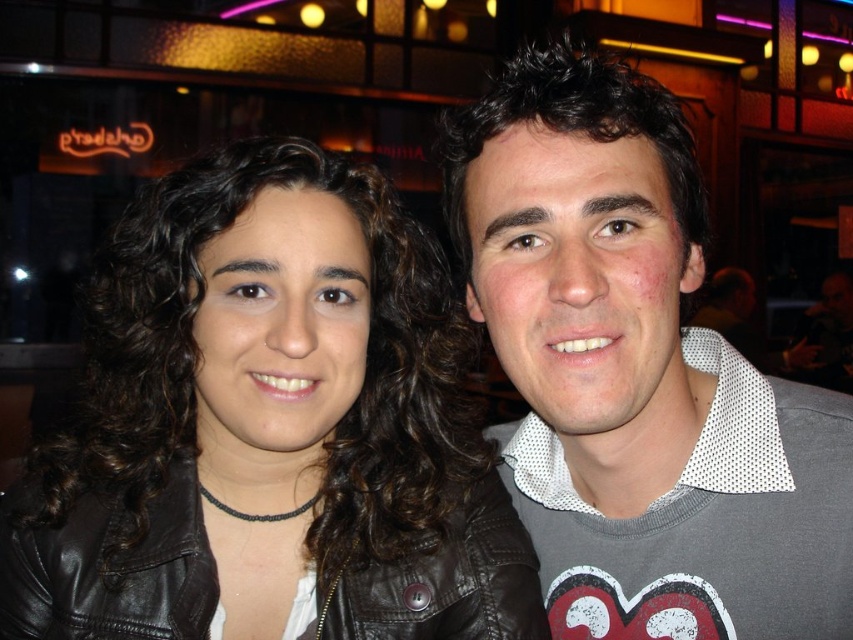
Who is higher up, gray mesh shirt at center or black leather jacket at center?

Positioned higher is gray mesh shirt at center.

Does point (762, 477) come closer to viewer compared to point (175, 536)?

That is True.

Where is `gray mesh shirt at center`? The height and width of the screenshot is (640, 853). gray mesh shirt at center is located at coordinates (637, 376).

Where is `black leather jacket at upper left`? This screenshot has height=640, width=853. black leather jacket at upper left is located at coordinates (268, 429).

Who is taller, black leather jacket at upper left or gray mesh shirt at center?

gray mesh shirt at center is taller.

Where is `black leather jacket at upper left`? The width and height of the screenshot is (853, 640). black leather jacket at upper left is located at coordinates (268, 429).

Locate an element on the screen. The image size is (853, 640). black leather jacket at upper left is located at coordinates (268, 429).

Measure the distance between black leather jacket at upper left and black leather jacket at center.

A distance of 3.71 inches exists between black leather jacket at upper left and black leather jacket at center.

Can you confirm if black leather jacket at upper left is smaller than black leather jacket at center?

No.

Is point (172, 515) less distant than point (158, 628)?

No.

This screenshot has height=640, width=853. I want to click on black leather jacket at upper left, so click(268, 429).